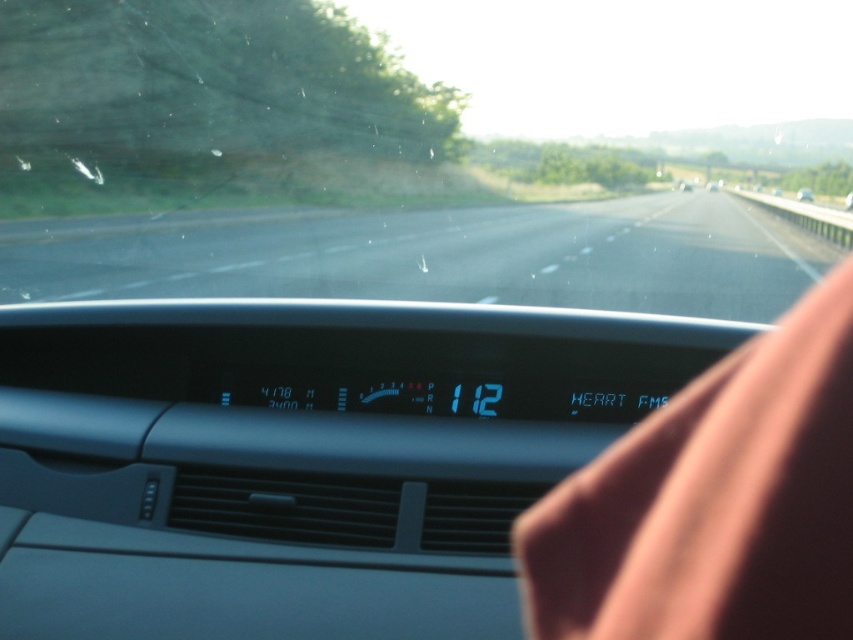
Looking at this image, you are driving a car and want to know if the transparent glass windshield at center can fully cover the metallic silver car at center when viewed from the front. Based on their sizes, can it?

The transparent glass windshield at center has a larger width than the metallic silver car at center, so yes, the transparent glass windshield at center can fully cover the metallic silver car at center when viewed from the front.

You are driving a car and want to know if the metallic silver car at center is on the black asphalt highway at center. Based on the scene description, can you confirm this?

The black asphalt highway at center is positioned under the metallic silver car at center, so yes, the metallic silver car at center is on the black asphalt highway at center.